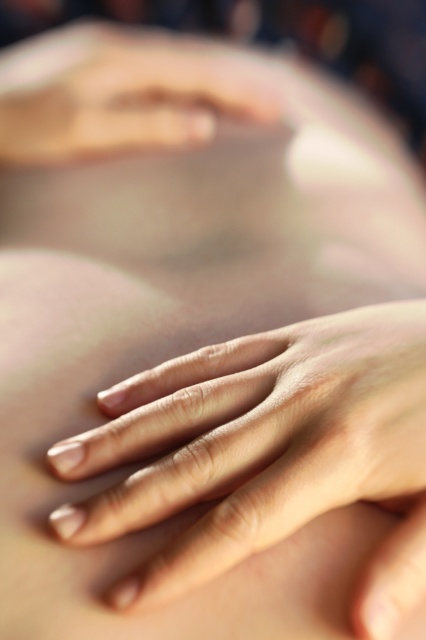
Question: Observing the image, what is the correct spatial positioning of smooth skin hand at center in reference to smooth skin hand at upper center?

Choices:
 (A) above
 (B) below

Answer: (B)

Question: Among these points, which one is farthest from the camera?

Choices:
 (A) (184, 58)
 (B) (299, 465)

Answer: (A)

Question: Does smooth skin hand at center lie behind smooth skin hand at upper center?

Choices:
 (A) yes
 (B) no

Answer: (B)

Question: Which point is farther to the camera?

Choices:
 (A) smooth skin hand at upper center
 (B) smooth skin hand at center

Answer: (A)

Question: From the image, what is the correct spatial relationship of smooth skin hand at center in relation to smooth skin hand at upper center?

Choices:
 (A) right
 (B) left

Answer: (A)

Question: Among these objects, which one is nearest to the camera?

Choices:
 (A) smooth skin hand at upper center
 (B) smooth skin hand at center

Answer: (B)